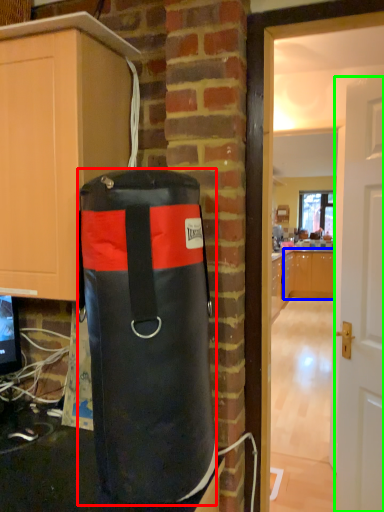
Question: Which is nearer to the punching bag (highlighted by a red box)? cabinetry (highlighted by a blue box) or door (highlighted by a green box).

Choices:
 (A) cabinetry
 (B) door

Answer: (B)